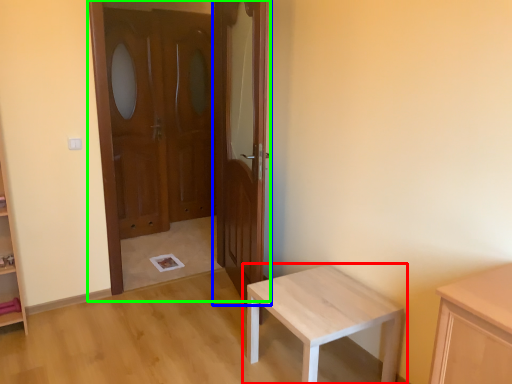
Question: Which object is positioned farthest from table (highlighted by a red box)? Select from door (highlighted by a blue box) and door (highlighted by a green box).

Choices:
 (A) door
 (B) door

Answer: (B)